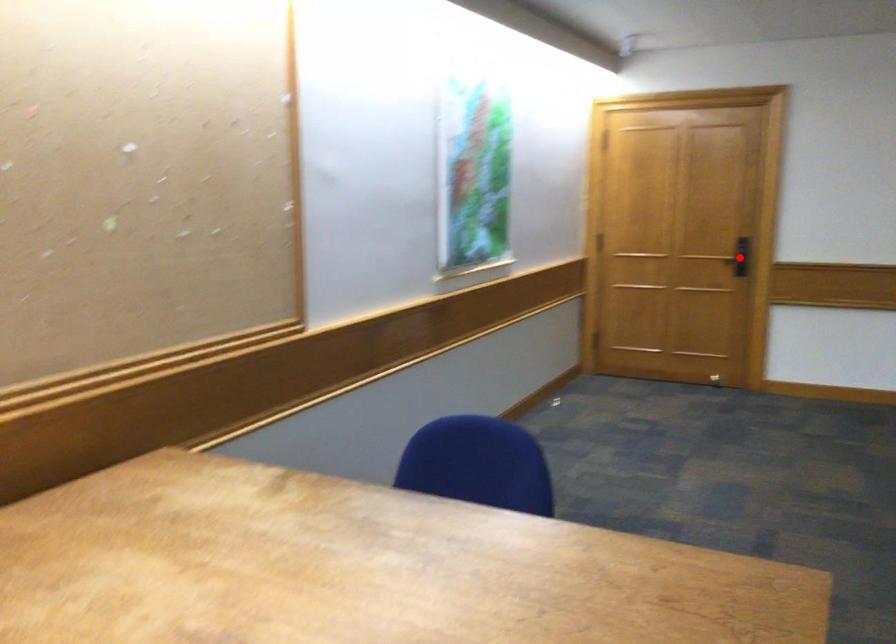
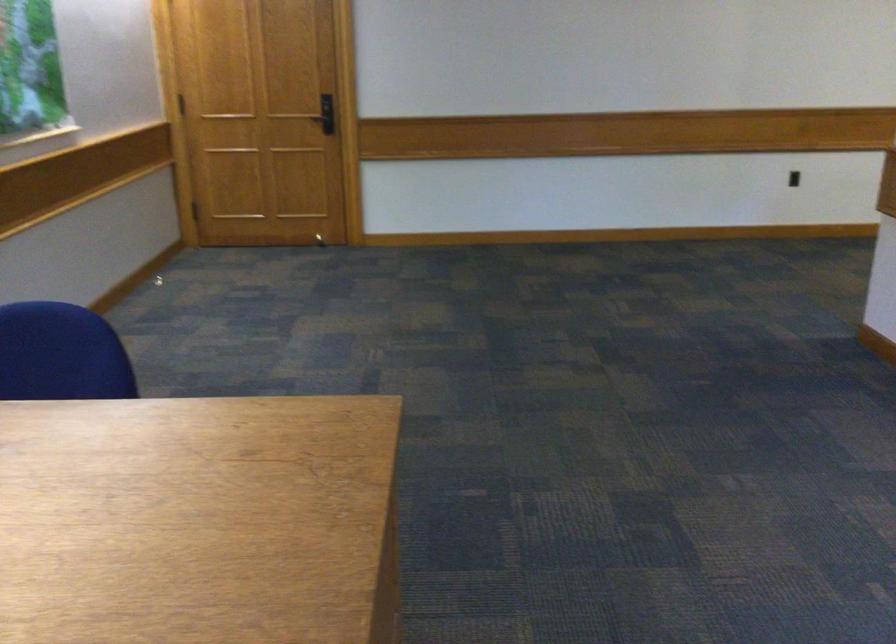
Where in the second image is the point corresponding to the highlighted location from the first image?

(331, 116)